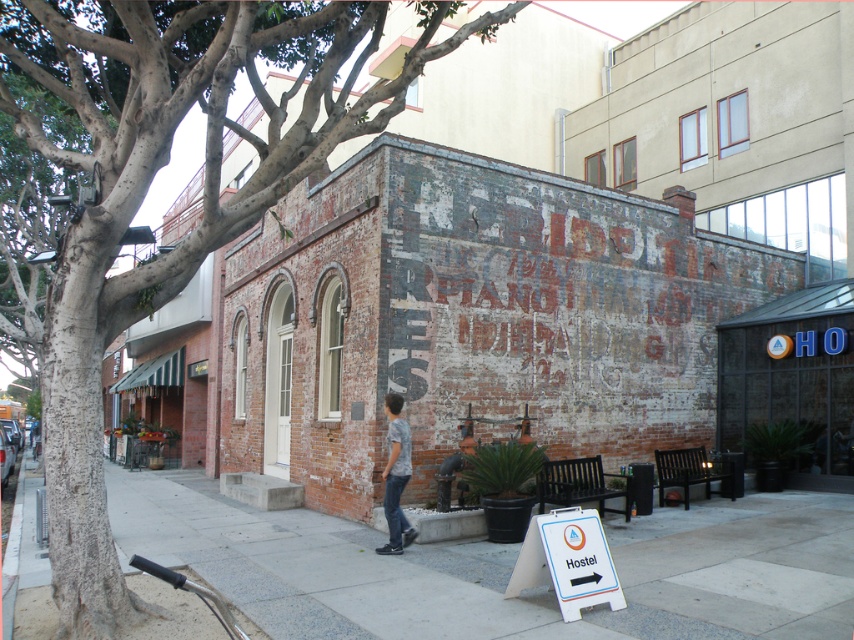
You are a delivery person trying to find a place to leave a package. You see a smooth bark tree at left and a camouflage shirt at center. Where should you place the package so it is not hidden by either object?

The smooth bark tree at left is positioned over camouflage shirt at center, so placing the package between them would ensure it is visible and not obstructed by either object.

You are a delivery person trying to park your 1.5 meter wide cart between the smooth bark tree at left and the white plastic sign at lower right. Can your cart fit in that space?

The smooth bark tree at left is wider than the white plastic sign at lower right. However, the question is about the space between them, not their widths. The description does not provide information about the distance between the tree and the sign, so we cannot determine if the cart will fit. Please check the actual distance.